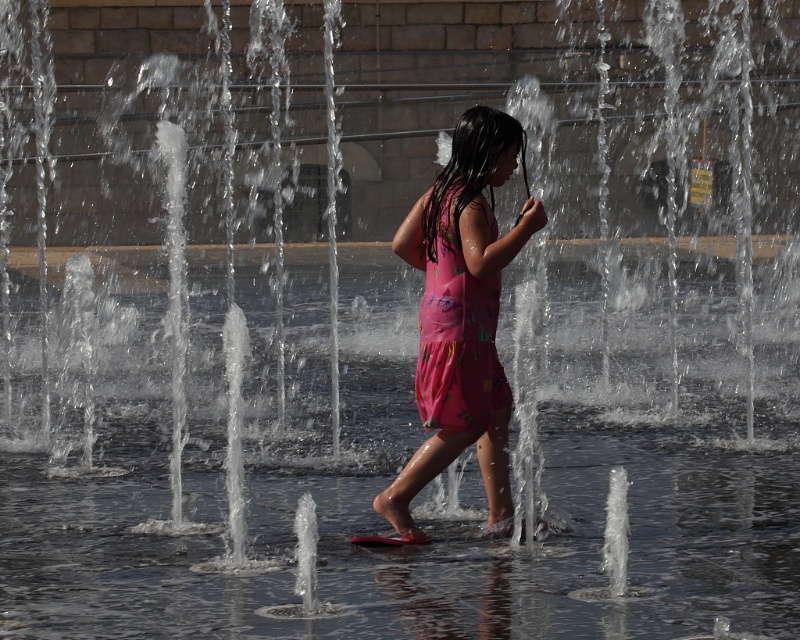
Question: Can you confirm if pink floral dress at center is wider than pink floral fabric dress at center?

Choices:
 (A) yes
 (B) no

Answer: (A)

Question: Which object is closer to the camera taking this photo?

Choices:
 (A) pink floral fabric dress at center
 (B) pink floral dress at center

Answer: (B)

Question: Is pink floral dress at center further to camera compared to pink floral fabric dress at center?

Choices:
 (A) no
 (B) yes

Answer: (A)

Question: Is pink floral dress at center thinner than pink floral fabric dress at center?

Choices:
 (A) no
 (B) yes

Answer: (A)